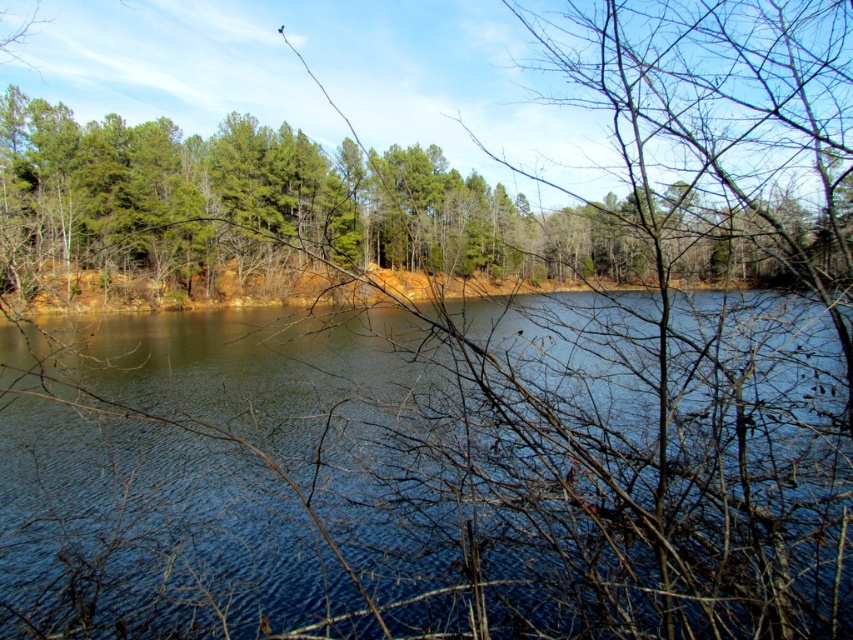
You are standing at the edge of the lake and notice the blue water at center and the green matte trees at center. Which object appears taller from your vantage point?

The green matte trees at center appear taller than the blue water at center because the blue water at center is not as tall as the green matte trees at center.

You are an artist planning to paint the scene. You want to ensure the blue water at center and green matte trees at center are proportionally accurate. Which object should you paint to be wider?

The green matte trees at center should be painted wider because the blue water at center has a lesser width compared to green matte trees at center according to the description.

Based on the photo, you are standing on the shore of the lake and looking at the blue water at center and the green matte trees at center. Which object is closer to the ground?

The blue water at center is below green matte trees at center, so the blue water at center is closer to the ground.